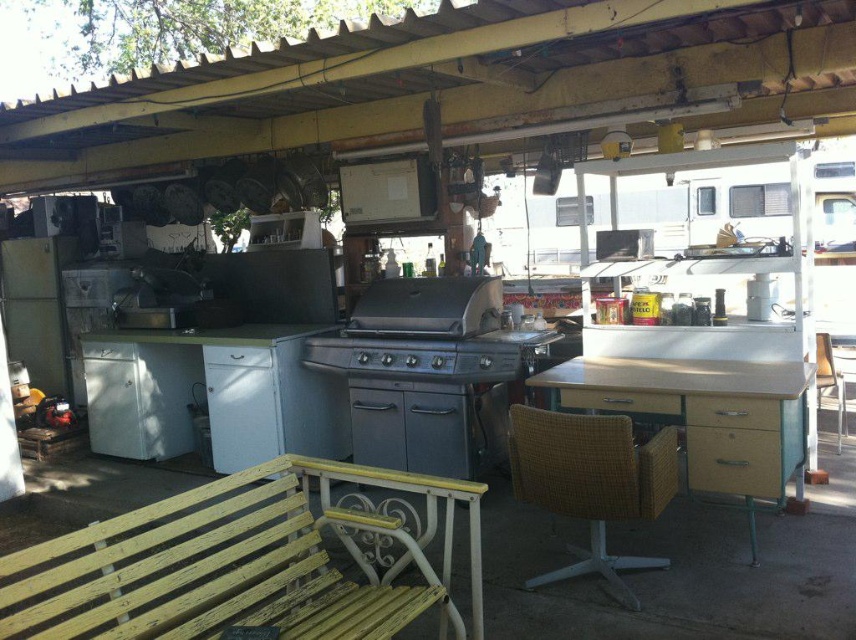
Question: Which object appears closest to the camera in this image?

Choices:
 (A) woven brown chair at center
 (B) light wood/wooden table at center
 (C) yellow painted wood bench at lower left

Answer: (C)

Question: Among these points, which one is farthest from the camera?

Choices:
 (A) (415, 540)
 (B) (574, 515)
 (C) (736, 435)

Answer: (C)

Question: Is woven brown chair at center above woven wood chair at right?

Choices:
 (A) yes
 (B) no

Answer: (B)

Question: Is woven brown chair at center below woven wood chair at right?

Choices:
 (A) yes
 (B) no

Answer: (A)

Question: Considering the real-world distances, which object is farthest from the light wood/wooden table at center?

Choices:
 (A) yellow painted wood bench at lower left
 (B) woven brown chair at center
 (C) woven wood chair at right

Answer: (A)

Question: Is woven brown chair at center further to camera compared to woven wood chair at right?

Choices:
 (A) no
 (B) yes

Answer: (A)